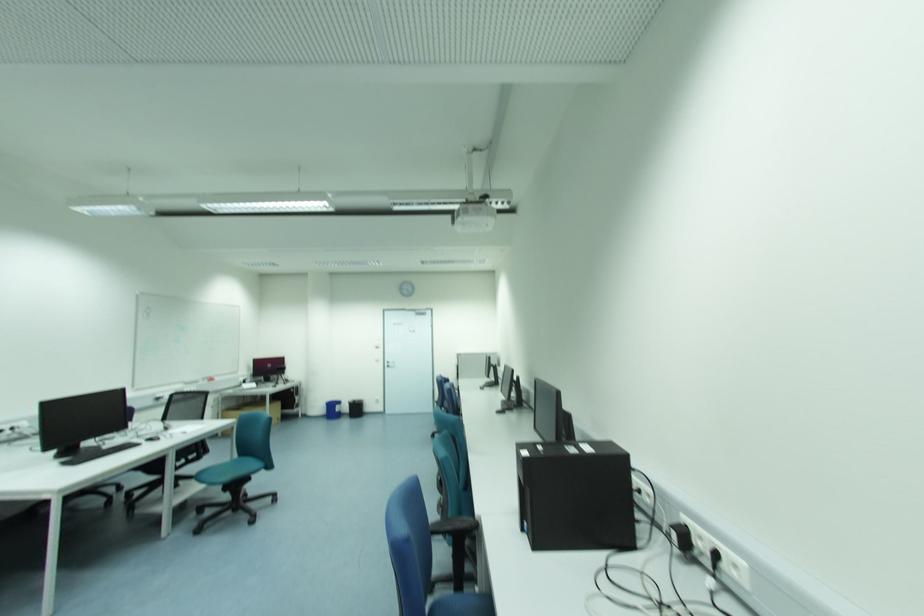
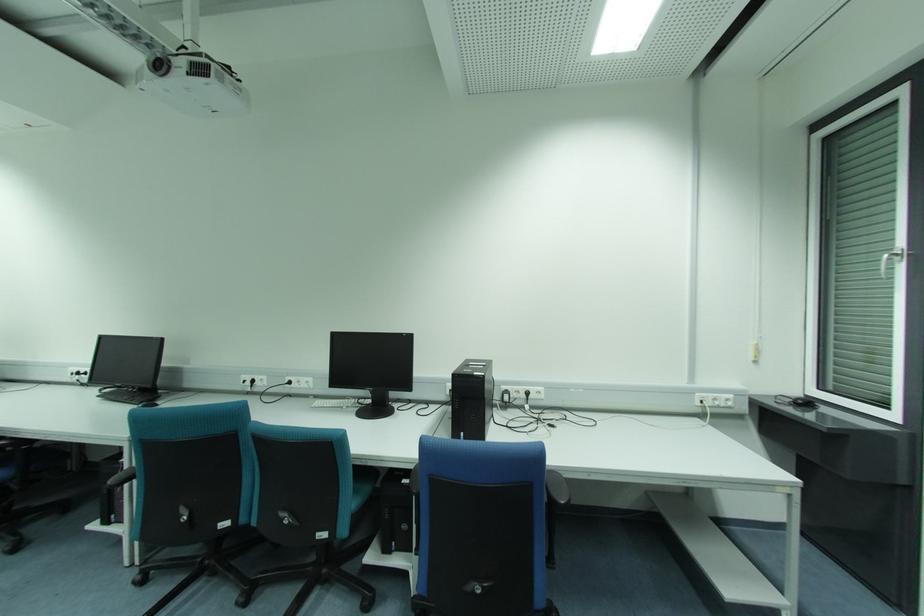
In the second image, find the point that corresponds to point (744, 564) in the first image.

(541, 389)